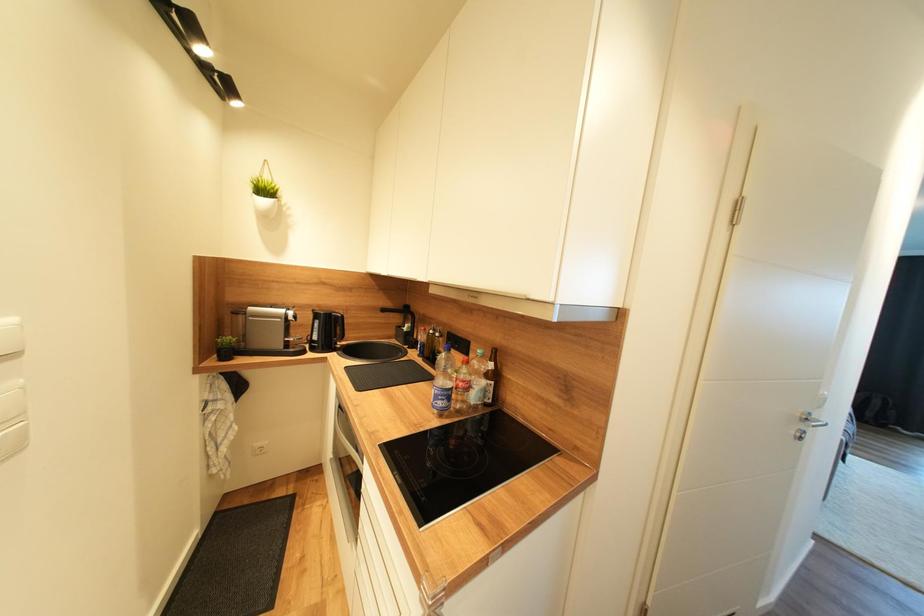
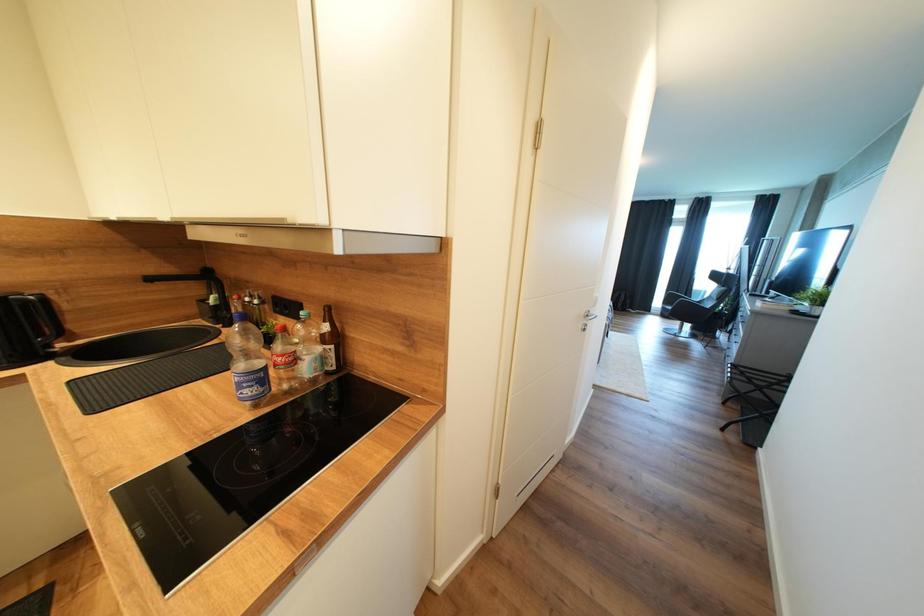
Question: The images are taken continuously from a first-person perspective. In which direction is your viewpoint rotating?

Choices:
 (A) Left
 (B) Right
 (C) Up
 (D) Down

Answer: (B)